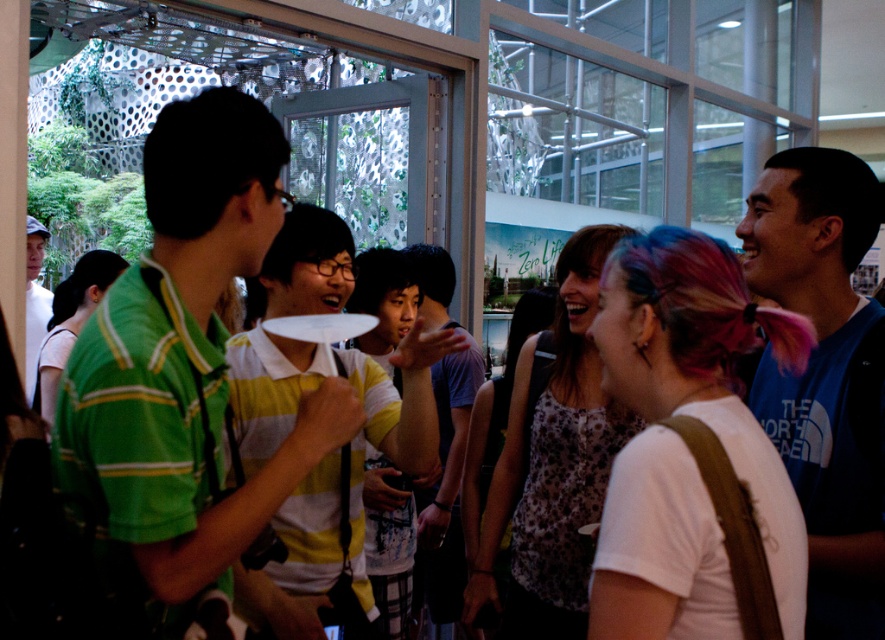
This screenshot has height=640, width=885. What do you see at coordinates (824, 372) in the screenshot?
I see `blue cotton t-shirt at right` at bounding box center [824, 372].

Which of these two, blue cotton t-shirt at right or leopard print tank top at center, stands taller?

leopard print tank top at center

Is point (812, 518) in front of point (475, 602)?

That is True.

Where is `blue cotton t-shirt at right`? The width and height of the screenshot is (885, 640). blue cotton t-shirt at right is located at coordinates (824, 372).

Can you confirm if yellow striped shirt at center is positioned to the right of white paper plate at center?

Correct, you'll find yellow striped shirt at center to the right of white paper plate at center.

Does point (455, 524) come behind point (310, 320)?

Yes, it is.

You are a GUI agent. You are given a task and a screenshot of the screen. Output one action in this format:
    pyautogui.click(x=<x>, y=<y>)
    Task: Click on the yellow striped shirt at center
    This screenshot has height=640, width=885.
    Given the screenshot: What is the action you would take?
    pyautogui.click(x=445, y=490)

Find the location of a particular element. Image resolution: width=885 pixels, height=640 pixels. green striped shirt at center is located at coordinates (183, 371).

Looking at this image, who is shorter, green striped shirt at center or white paper plate at center?

With less height is white paper plate at center.

Is point (99, 566) farther from viewer compared to point (293, 316)?

No, it is in front of (293, 316).

Identify the location of green striped shirt at center. (183, 371).